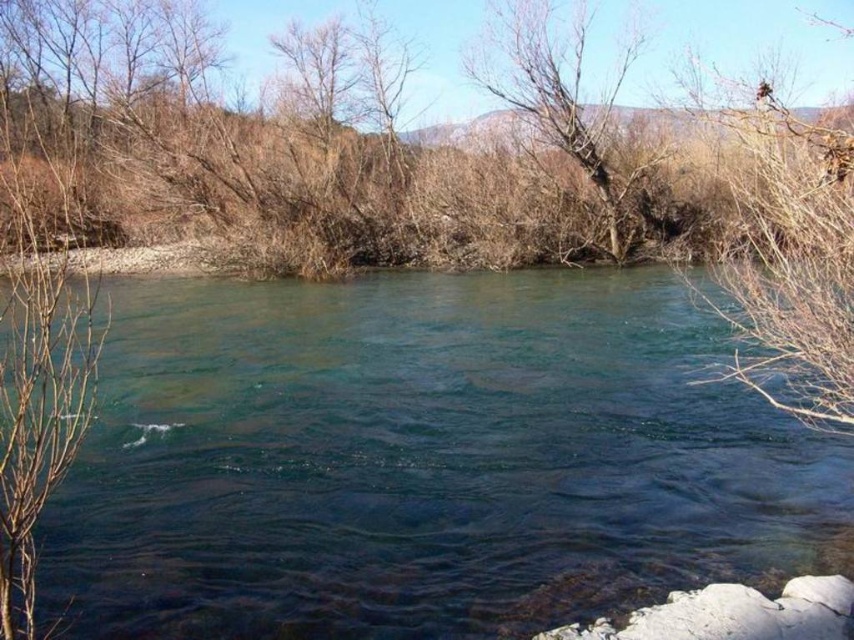
At what (x,y) coordinates should I click in order to perform the action: click on clear water at center. Please return your answer as a coordinate pair (x, y). The height and width of the screenshot is (640, 854). Looking at the image, I should click on (423, 460).

Which of these two, clear water at center or bare branches at upper right, stands shorter?

Standing shorter between the two is clear water at center.

Locate an element on the screen. This screenshot has height=640, width=854. clear water at center is located at coordinates (423, 460).

Is bare branches at upper right above bare branches at center?

No, bare branches at upper right is not above bare branches at center.

Which is in front, point (736, 124) or point (554, 29)?

Point (736, 124) is in front.

Who is more forward, (782, 314) or (515, 70)?

Point (782, 314) is in front.

Locate an element on the screen. Image resolution: width=854 pixels, height=640 pixels. bare branches at upper right is located at coordinates (790, 259).

Is clear water at center wider than bare branches at center?

Indeed, clear water at center has a greater width compared to bare branches at center.

Who is shorter, clear water at center or bare branches at center?

Standing shorter between the two is clear water at center.

Where is `clear water at center`? clear water at center is located at coordinates (423, 460).